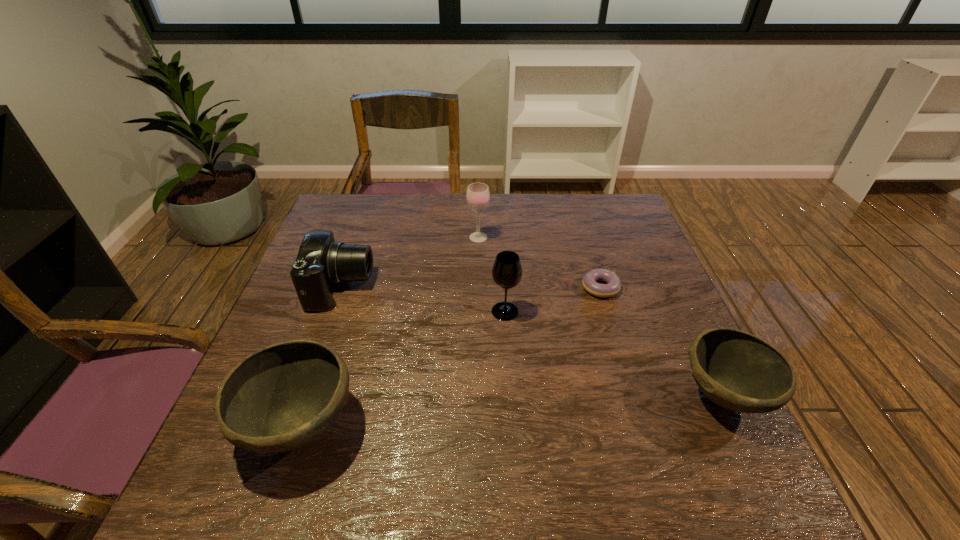
This screenshot has height=540, width=960. What are the coordinates of `free space for an extra bowl to achieve even spacing` in the screenshot? It's located at click(x=517, y=410).